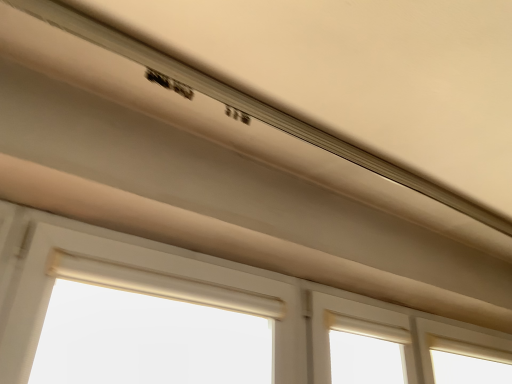
Question: Should I look upward or downward to see white matte window at center?

Choices:
 (A) down
 (B) up

Answer: (A)

Question: Is matte white exhaust hood at upper center at the right side of white matte window at center?

Choices:
 (A) no
 (B) yes

Answer: (B)

Question: Is matte white exhaust hood at upper center shorter than white matte window at center?

Choices:
 (A) no
 (B) yes

Answer: (A)

Question: Does matte white exhaust hood at upper center have a greater width compared to white matte window at center?

Choices:
 (A) yes
 (B) no

Answer: (A)

Question: Is matte white exhaust hood at upper center at the left side of white matte window at center?

Choices:
 (A) yes
 (B) no

Answer: (B)

Question: From the image's perspective, does matte white exhaust hood at upper center appear higher than white matte window at center?

Choices:
 (A) yes
 (B) no

Answer: (A)

Question: Is matte white exhaust hood at upper center smaller than white matte window at center?

Choices:
 (A) yes
 (B) no

Answer: (B)

Question: From a real-world perspective, does beige fabric curtain at lower center stand above white matte window at center?

Choices:
 (A) yes
 (B) no

Answer: (B)

Question: Is beige fabric curtain at lower center to the right of white matte window at center from the viewer's perspective?

Choices:
 (A) no
 (B) yes

Answer: (A)

Question: Is white matte window at center completely or partially inside beige fabric curtain at lower center?

Choices:
 (A) yes
 (B) no

Answer: (B)

Question: Is beige fabric curtain at lower center thinner than white matte window at center?

Choices:
 (A) no
 (B) yes

Answer: (A)

Question: Is beige fabric curtain at lower center with white matte window at center?

Choices:
 (A) yes
 (B) no

Answer: (A)

Question: Considering the relative sizes of beige fabric curtain at lower center and white matte window at center in the image provided, is beige fabric curtain at lower center wider than white matte window at center?

Choices:
 (A) no
 (B) yes

Answer: (B)

Question: From the image's perspective, is white matte window at center located above matte white exhaust hood at upper center?

Choices:
 (A) no
 (B) yes

Answer: (A)